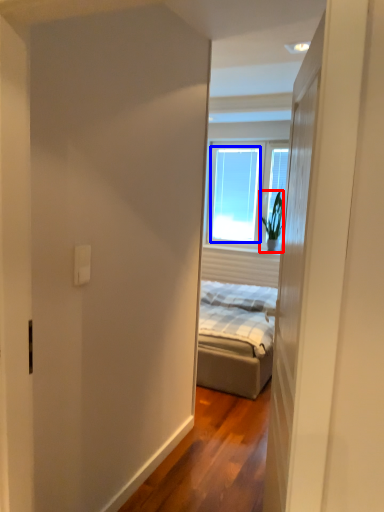
Question: Among these objects, which one is farthest to the camera, houseplant (highlighted by a red box) or window (highlighted by a blue box)?

Choices:
 (A) houseplant
 (B) window

Answer: (B)